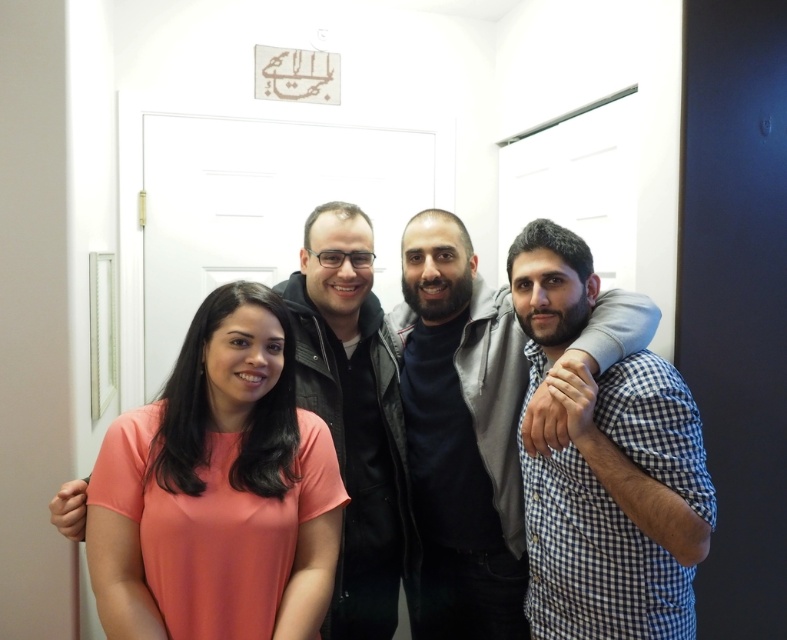
Question: Can you confirm if matte coral shirt at center is smaller than blue checkered shirt at right?

Choices:
 (A) no
 (B) yes

Answer: (B)

Question: Among these points, which one is farthest from the camera?

Choices:
 (A) (667, 577)
 (B) (538, 444)
 (C) (209, 627)

Answer: (A)

Question: Which point is closer to the camera?

Choices:
 (A) dark gray sweater at center
 (B) matte coral shirt at center

Answer: (B)

Question: Does matte coral shirt at center have a smaller size compared to blue checkered shirt at right?

Choices:
 (A) no
 (B) yes

Answer: (B)

Question: Can you confirm if matte coral shirt at center is positioned to the left of blue checkered shirt at right?

Choices:
 (A) no
 (B) yes

Answer: (B)

Question: Among these objects, which one is nearest to the camera?

Choices:
 (A) dark gray sweater at center
 (B) blue checkered shirt at right

Answer: (B)